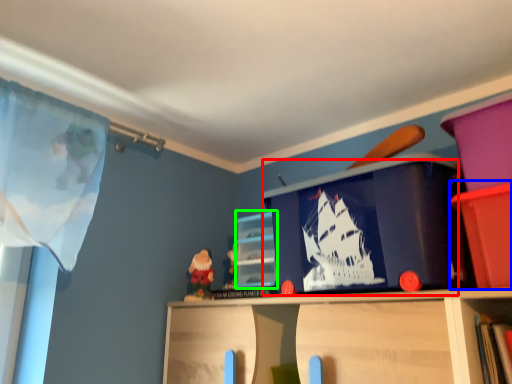
Question: Which is nearer to the window screen (highlighted by a red box)? cabinet (highlighted by a blue box) or cabinet (highlighted by a green box).

Choices:
 (A) cabinet
 (B) cabinet

Answer: (A)